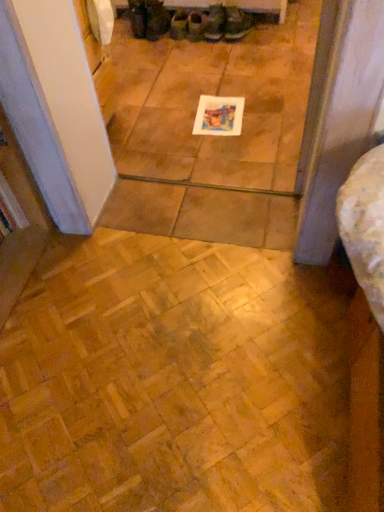
Where is `free space on the front side of matte green fabric shoe at center, marked as the fourth footwear in a left-to-right arrangement`? free space on the front side of matte green fabric shoe at center, marked as the fourth footwear in a left-to-right arrangement is located at coordinates pos(196,47).